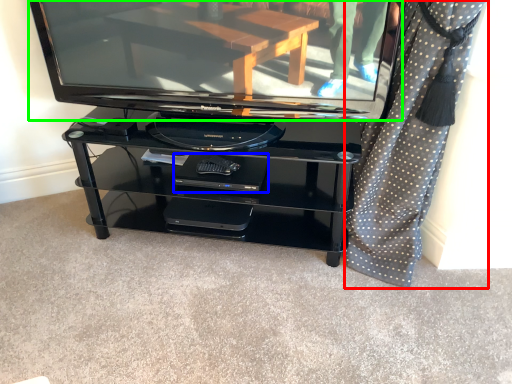
Question: Which object is the farthest from curtain (highlighted by a red box)? Choose among these: footrest (highlighted by a blue box) or television (highlighted by a green box).

Choices:
 (A) footrest
 (B) television

Answer: (A)